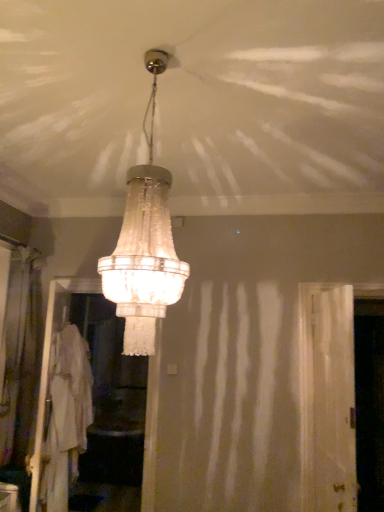
This screenshot has width=384, height=512. What do you see at coordinates (87, 404) in the screenshot?
I see `white translucent screen door at center, arranged as the first screen door when viewed from the left` at bounding box center [87, 404].

This screenshot has height=512, width=384. I want to click on clear plastic screen door at right, the first screen door in the back-to-front sequence, so click(369, 403).

The width and height of the screenshot is (384, 512). What do you see at coordinates (330, 401) in the screenshot? I see `white translucent screen door at right, the third screen door from the back` at bounding box center [330, 401].

What are the coordinates of `white translucent screen door at right, which ranks as the second screen door in right-to-left order` in the screenshot? It's located at pyautogui.click(x=330, y=401).

This screenshot has width=384, height=512. What are the coordinates of `clear glass chandelier at center` in the screenshot? It's located at (145, 244).

The height and width of the screenshot is (512, 384). Identify the location of white translucent screen door at center, arranged as the second screen door when viewed from the front. (87, 404).

Where is `lamp on the right of white translucent screen door at center, arranged as the first screen door when viewed from the left`? lamp on the right of white translucent screen door at center, arranged as the first screen door when viewed from the left is located at coordinates (145, 244).

Are white translucent screen door at center, arranged as the second screen door when viewed from the front, and clear glass chandelier at center far apart?

Yes.

Is white translucent screen door at center, which ranks as the third screen door in right-to-left order, not inside clear glass chandelier at center?

Yes.

Is clear plastic screen door at right, which is counted as the third screen door, starting from the left, wider or thinner than clear glass chandelier at center?

In the image, clear plastic screen door at right, which is counted as the third screen door, starting from the left, appears to be more narrow than clear glass chandelier at center.

How distant is clear plastic screen door at right, the 3th screen door when ordered from front to back, from clear glass chandelier at center?

clear plastic screen door at right, the 3th screen door when ordered from front to back, and clear glass chandelier at center are 1.61 meters apart from each other.

From a real-world perspective, between clear plastic screen door at right, the first screen door in the back-to-front sequence, and clear glass chandelier at center, who is vertically lower?

In real-world perspective, clear plastic screen door at right, the first screen door in the back-to-front sequence, is lower.

Is clear plastic screen door at right, which is counted as the third screen door, starting from the left, behind clear glass chandelier at center?

That is True.

Find the location of a particular element. screen door in front of the white cotton robe at lower left is located at coordinates (330, 401).

Does white cotton robe at lower left have a greater width compared to white translucent screen door at right, which ranks as the second screen door in right-to-left order?

Indeed, white cotton robe at lower left has a greater width compared to white translucent screen door at right, which ranks as the second screen door in right-to-left order.

How many degrees apart are the facing directions of white cotton robe at lower left and white translucent screen door at right, the third screen door from the back?

The facing directions of white cotton robe at lower left and white translucent screen door at right, the third screen door from the back, are 12.2 degrees apart.

From the image's perspective, is white cotton robe at lower left positioned above or below white translucent screen door at right, the 2th screen door viewed from the left?

From the image's perspective, white cotton robe at lower left appears below white translucent screen door at right, the 2th screen door viewed from the left.

Between silky beige curtain at left and white cotton robe at lower left, which one has larger size?

Bigger between the two is silky beige curtain at left.

Which point is more forward, (40,338) or (83,432)?

The point (83,432) is more forward.

In the scene shown: Considering the sizes of objects silky beige curtain at left and white cotton robe at lower left in the image provided, who is taller, silky beige curtain at left or white cotton robe at lower left?

silky beige curtain at left.

From the picture: From a real-world perspective, which object stands above the other?

In real-world perspective, silky beige curtain at left is above.

From a real-world perspective, which is physically above, white translucent screen door at center, arranged as the second screen door when viewed from the front, or clear plastic screen door at right, the 3th screen door when ordered from front to back?

Result: white translucent screen door at center, arranged as the second screen door when viewed from the front, from a real-world perspective.

Looking at this image, would you say white translucent screen door at center, which ranks as the third screen door in right-to-left order, contains clear plastic screen door at right, the first screen door in the back-to-front sequence?

No, clear plastic screen door at right, the first screen door in the back-to-front sequence, is not surrounded by white translucent screen door at center, which ranks as the third screen door in right-to-left order.

From the image's perspective, is white translucent screen door at center, which appears as the second screen door when viewed from the back, located above or below clear plastic screen door at right, which ranks as the 1th screen door in right-to-left order?

From the image's perspective, white translucent screen door at center, which appears as the second screen door when viewed from the back, appears above clear plastic screen door at right, which ranks as the 1th screen door in right-to-left order.

Can you confirm if clear glass chandelier at center is taller than white translucent screen door at center, arranged as the first screen door when viewed from the left?

Incorrect, the height of clear glass chandelier at center is not larger of that of white translucent screen door at center, arranged as the first screen door when viewed from the left.

Is clear glass chandelier at center situated inside white translucent screen door at center, which appears as the second screen door when viewed from the back, or outside?

clear glass chandelier at center is not enclosed by white translucent screen door at center, which appears as the second screen door when viewed from the back.

Which object is more forward, clear glass chandelier at center or white translucent screen door at center, arranged as the second screen door when viewed from the front?

Positioned in front is clear glass chandelier at center.

Consider the image. Is clear glass chandelier at center beside white translucent screen door at center, arranged as the second screen door when viewed from the front?

No, clear glass chandelier at center is not next to white translucent screen door at center, arranged as the second screen door when viewed from the front.

How distant is clear plastic screen door at right, which ranks as the 1th screen door in right-to-left order, from white cotton robe at lower left?

2.01 meters.

The image size is (384, 512). Identify the location of robe on the left side of clear plastic screen door at right, which is counted as the third screen door, starting from the left. (66, 416).

Can you confirm if clear plastic screen door at right, which is counted as the third screen door, starting from the left, is shorter than white cotton robe at lower left?

In fact, clear plastic screen door at right, which is counted as the third screen door, starting from the left, may be taller than white cotton robe at lower left.

Is clear plastic screen door at right, which is counted as the third screen door, starting from the left, situated inside white cotton robe at lower left or outside?

clear plastic screen door at right, which is counted as the third screen door, starting from the left, is outside white cotton robe at lower left.

Find the location of a particular element. lamp that appears in front of the white translucent screen door at center, which ranks as the third screen door in right-to-left order is located at coordinates (145, 244).

The width and height of the screenshot is (384, 512). I want to click on lamp above the clear plastic screen door at right, which ranks as the 1th screen door in right-to-left order (from a real-world perspective), so click(x=145, y=244).

Estimate the real-world distances between objects in this image. Which object is closer to white translucent screen door at right, marked as the 1th screen door in a front-to-back arrangement, white translucent screen door at center, which appears as the second screen door when viewed from the back, or white cotton robe at lower left?

white cotton robe at lower left is positioned closer to the anchor white translucent screen door at right, marked as the 1th screen door in a front-to-back arrangement.

Looking at the image, which one is located further to silky beige curtain at left, white translucent screen door at right, which ranks as the second screen door in right-to-left order, or clear plastic screen door at right, the first screen door in the back-to-front sequence?

clear plastic screen door at right, the first screen door in the back-to-front sequence, is further to silky beige curtain at left.

From the image, which object appears to be farther from silky beige curtain at left, clear glass chandelier at center or clear plastic screen door at right, the 3th screen door when ordered from front to back?

clear plastic screen door at right, the 3th screen door when ordered from front to back, lies further to silky beige curtain at left than the other object.

Considering their positions, is white translucent screen door at center, arranged as the second screen door when viewed from the front, positioned further to clear glass chandelier at center than clear plastic screen door at right, which is counted as the third screen door, starting from the left?

white translucent screen door at center, arranged as the second screen door when viewed from the front, is positioned further to the anchor clear glass chandelier at center.

Considering their positions, is white translucent screen door at center, which appears as the second screen door when viewed from the back, positioned closer to silky beige curtain at left than clear plastic screen door at right, which ranks as the 1th screen door in right-to-left order?

Among the two, white translucent screen door at center, which appears as the second screen door when viewed from the back, is located nearer to silky beige curtain at left.

Estimate the real-world distances between objects in this image. Which object is further from white translucent screen door at center, arranged as the second screen door when viewed from the front, silky beige curtain at left or clear glass chandelier at center?

Based on the image, clear glass chandelier at center appears to be further to white translucent screen door at center, arranged as the second screen door when viewed from the front.

Looking at the image, which one is located further to white translucent screen door at right, the 2th screen door viewed from the left, clear plastic screen door at right, which is counted as the third screen door, starting from the left, or white translucent screen door at center, arranged as the second screen door when viewed from the front?

white translucent screen door at center, arranged as the second screen door when viewed from the front, is positioned further to the anchor white translucent screen door at right, the 2th screen door viewed from the left.

Looking at this image, considering their positions, is silky beige curtain at left positioned further to white translucent screen door at right, which ranks as the second screen door in right-to-left order, than white cotton robe at lower left?

Among the two, silky beige curtain at left is located further to white translucent screen door at right, which ranks as the second screen door in right-to-left order.

You are a GUI agent. You are given a task and a screenshot of the screen. Output one action in this format:
    pyautogui.click(x=<x>, y=<y>)
    Task: Click on the robe positioned between clear glass chandelier at center and white translucent screen door at center, which appears as the second screen door when viewed from the back, from near to far
    
    Given the screenshot: What is the action you would take?
    pyautogui.click(x=66, y=416)

Locate an element on the screen. This screenshot has width=384, height=512. robe situated between silky beige curtain at left and white translucent screen door at right, which ranks as the second screen door in right-to-left order, from left to right is located at coordinates (66, 416).

Where is `lamp between white cotton robe at lower left and white translucent screen door at right, which ranks as the second screen door in right-to-left order, from left to right`? lamp between white cotton robe at lower left and white translucent screen door at right, which ranks as the second screen door in right-to-left order, from left to right is located at coordinates (145, 244).

This screenshot has height=512, width=384. Find the location of `screen door between silky beige curtain at left and white translucent screen door at right, marked as the 1th screen door in a front-to-back arrangement, in the horizontal direction`. screen door between silky beige curtain at left and white translucent screen door at right, marked as the 1th screen door in a front-to-back arrangement, in the horizontal direction is located at coordinates (87, 404).